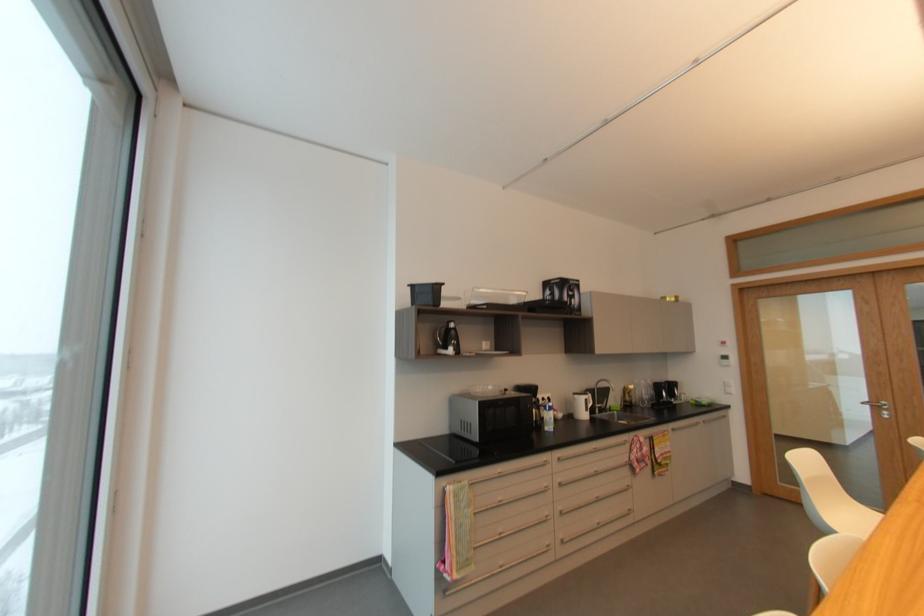
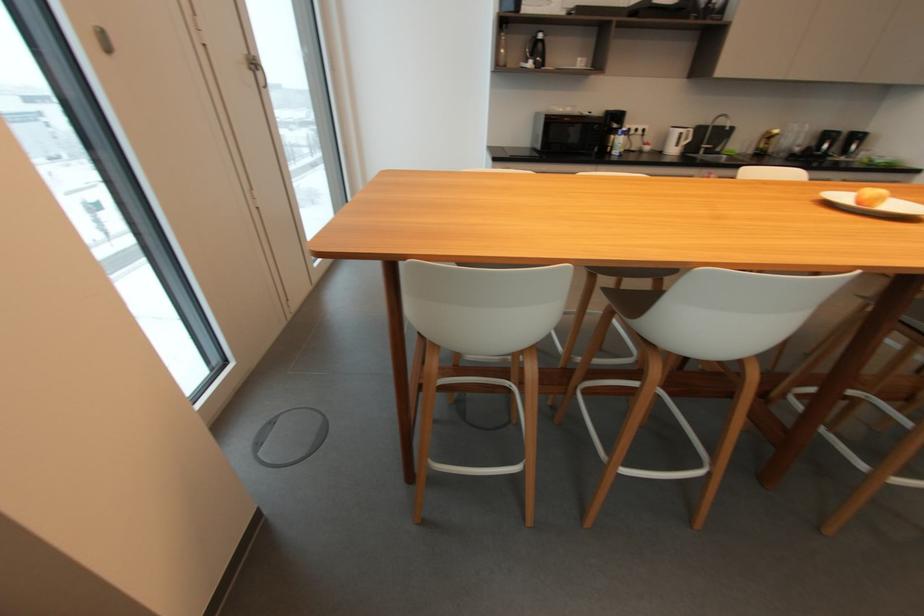
Locate, in the second image, the point that corresponds to pixel 456 323 in the first image.

(544, 36)